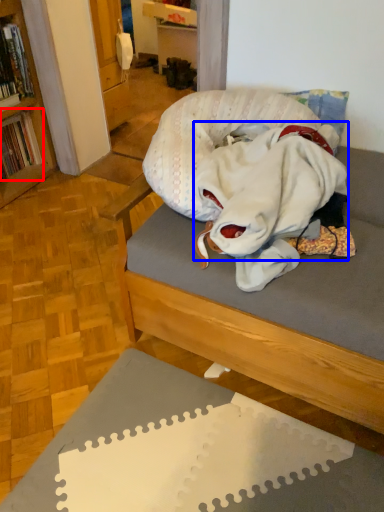
Question: Which point is further to the camera, book (highlighted by a red box) or clothing (highlighted by a blue box)?

Choices:
 (A) book
 (B) clothing

Answer: (A)